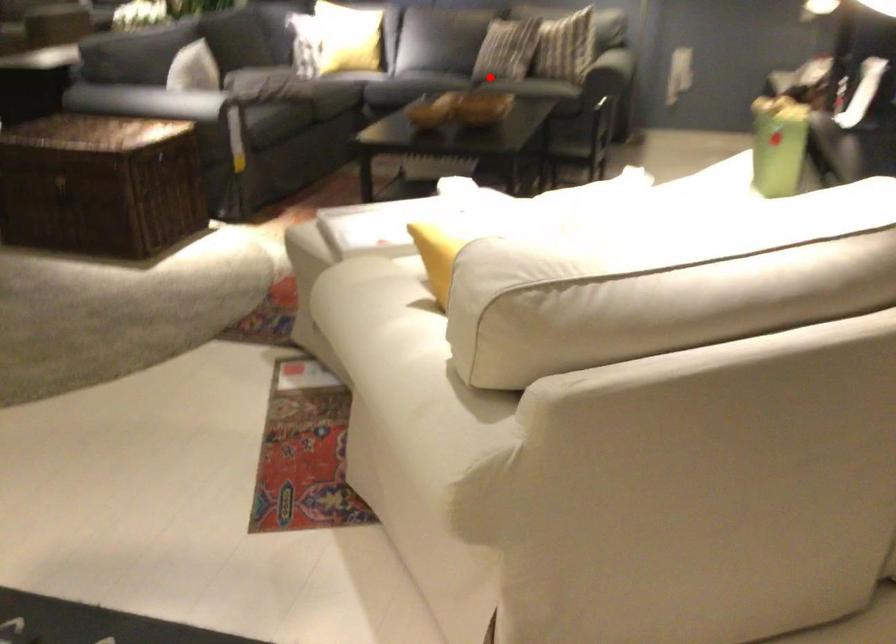
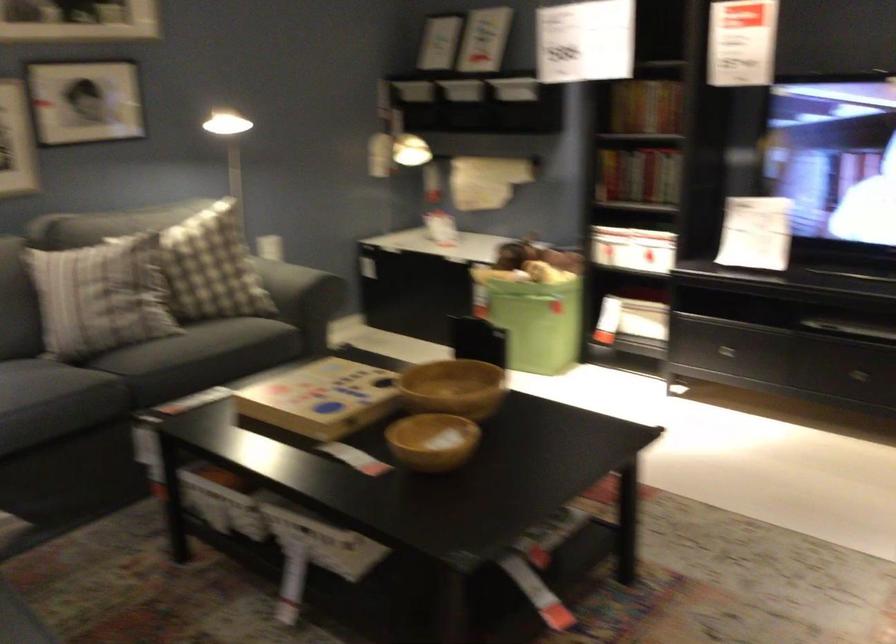
Question: I am providing you with two images of the same scene from different viewpoints. A red point is marked on the first image. At the location where the point appears in image 1, is it still visible in image 2?

Choices:
 (A) Yes
 (B) No

Answer: (A)